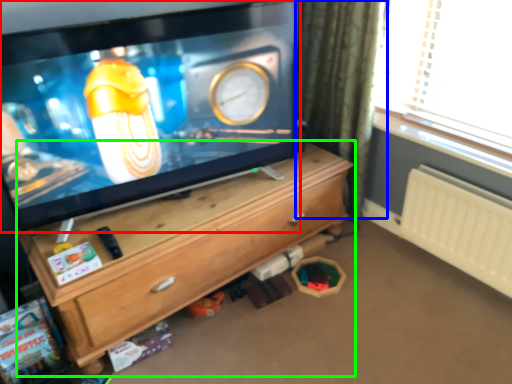
Question: Estimate the real-world distances between objects in this image. Which object is farther from television (highlighted by a red box), curtain (highlighted by a blue box) or chest of drawers (highlighted by a green box)?

Choices:
 (A) curtain
 (B) chest of drawers

Answer: (A)